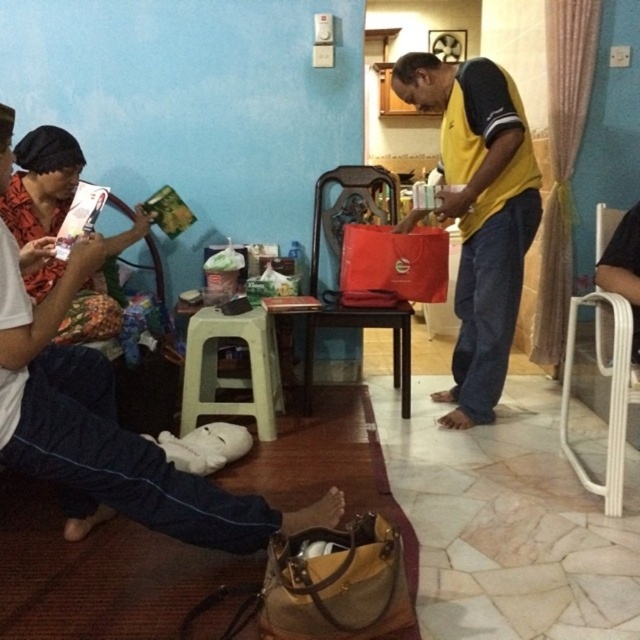
From the picture: Does yellow jersey at center appear on the right side of matte red shirt at left?

Indeed, yellow jersey at center is positioned on the right side of matte red shirt at left.

Measure the distance between point (506, 196) and camera.

Point (506, 196) and camera are 2.62 meters apart from each other.

Find the location of a particular element. Image resolution: width=640 pixels, height=640 pixels. yellow jersey at center is located at coordinates (480, 214).

Is yellow jersey at center closer to the viewer compared to dark brown wooden chair at center?

Yes, it is.

Can you confirm if yellow jersey at center is wider than dark brown wooden chair at center?

Yes.

Image resolution: width=640 pixels, height=640 pixels. What are the coordinates of `yellow jersey at center` in the screenshot? It's located at (480, 214).

Does yellow jersey at center have a smaller size compared to plastic stool at center?

No, yellow jersey at center is not smaller than plastic stool at center.

Looking at this image, between yellow jersey at center and plastic stool at center, which one has less height?

With less height is plastic stool at center.

This screenshot has height=640, width=640. What are the coordinates of `yellow jersey at center` in the screenshot? It's located at coord(480,214).

Find the location of `yellow jersey at center`. yellow jersey at center is located at coordinates tap(480, 214).